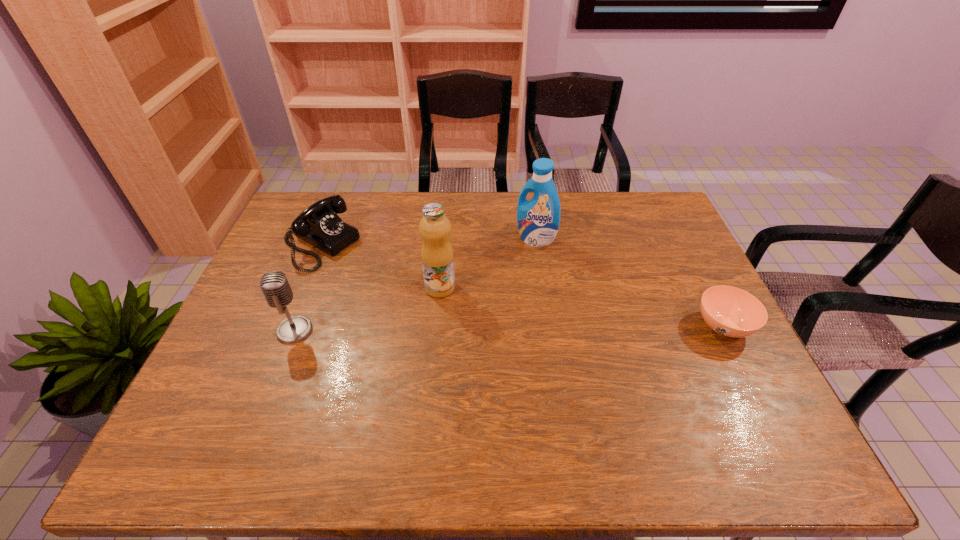
This screenshot has width=960, height=540. In order to click on the third tallest object in this screenshot , I will do `click(274, 285)`.

Locate an element on the screen. This screenshot has height=540, width=960. the shortest object is located at coordinates (732, 312).

Locate an element on the screen. the rightmost object is located at coordinates (732, 312).

This screenshot has height=540, width=960. Identify the location of fruit juice. (437, 257).

Locate an element on the screen. the third farthest object is located at coordinates (437, 257).

Where is `the fourth object from left to right`? The width and height of the screenshot is (960, 540). the fourth object from left to right is located at coordinates (538, 219).

At what (x,y) coordinates should I click in order to perform the action: click on the second shortest object. Please return your answer as a coordinate pair (x, y). Looking at the image, I should click on (319, 225).

Find the location of `free space located 0.200m on the front of the third tallest object`. free space located 0.200m on the front of the third tallest object is located at coordinates (262, 415).

Where is `vacant space located on the back of the soup bowl`? vacant space located on the back of the soup bowl is located at coordinates (691, 264).

I want to click on vacant space situated 0.390m on the front label of the third object from left to right, so click(x=580, y=348).